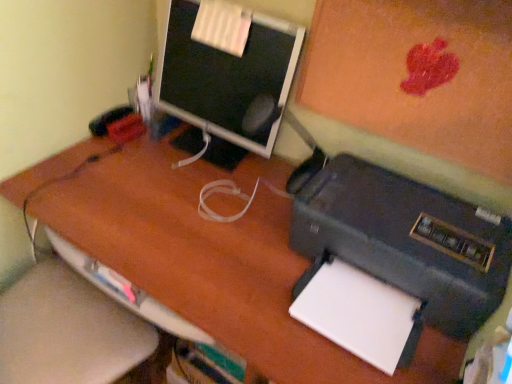
Find the location of a particular element. The width and height of the screenshot is (512, 384). vacant location below matte black monitor at upper center (from a real-world perspective) is located at coordinates point(211,151).